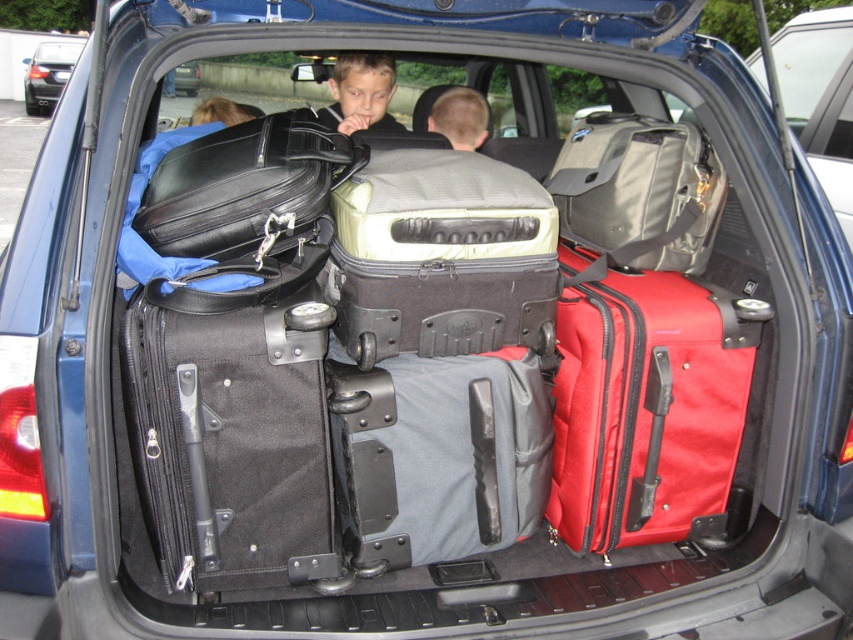
Question: Which point is closer to the camera?

Choices:
 (A) matte black suitcase at center
 (B) red fabric suitcase at right
 (C) matte gray suitcase at center
 (D) matte gray backpack at center

Answer: (C)

Question: Is black textured suitcase at center closer to the viewer compared to matte black suitcase at center?

Choices:
 (A) no
 (B) yes

Answer: (B)

Question: Can you confirm if red fabric suitcase at right is wider than black textured suitcase at center?

Choices:
 (A) yes
 (B) no

Answer: (B)

Question: Based on their relative distances, which object is farther from the matte gray suitcase at center?

Choices:
 (A) metallic silver car at upper left
 (B) red fabric suitcase at right

Answer: (A)

Question: Which of these objects is positioned farthest from the red fabric suitcase at right?

Choices:
 (A) smooth skin face at center
 (B) matte black suitcase at center

Answer: (B)

Question: Is black fabric suitcase at center closer to camera compared to black textured suitcase at center?

Choices:
 (A) yes
 (B) no

Answer: (A)